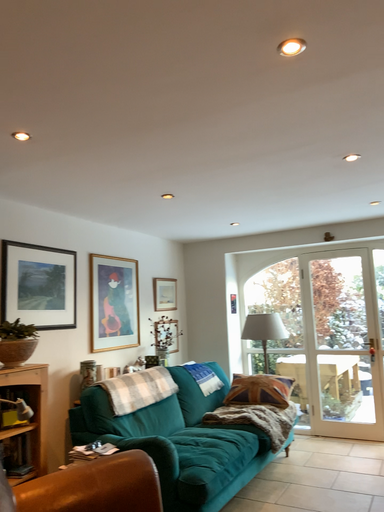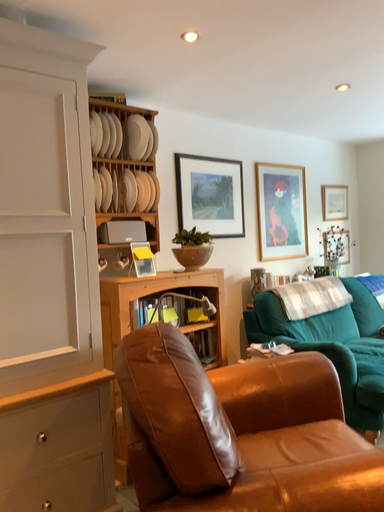
Question: Which way did the camera rotate in the video?

Choices:
 (A) rotated left
 (B) rotated right

Answer: (A)